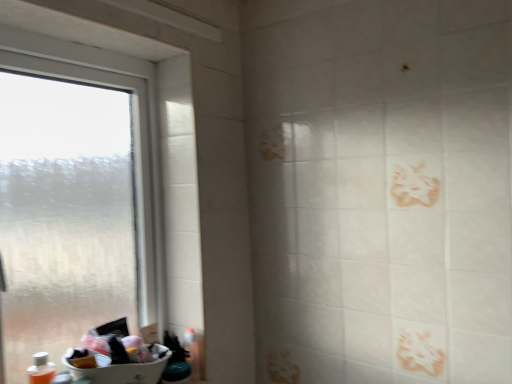
Question: From a real-world perspective, is translucent plastic bottle at lower left located higher than transparent frosted glass window at left?

Choices:
 (A) no
 (B) yes

Answer: (A)

Question: From a real-world perspective, is translucent plastic bottle at lower left under transparent frosted glass window at left?

Choices:
 (A) no
 (B) yes

Answer: (B)

Question: Is translucent plastic bottle at lower left positioned with its back to transparent frosted glass window at left?

Choices:
 (A) yes
 (B) no

Answer: (A)

Question: Can you confirm if translucent plastic bottle at lower left is smaller than transparent frosted glass window at left?

Choices:
 (A) no
 (B) yes

Answer: (B)

Question: Considering the relative sizes of translucent plastic bottle at lower left and transparent frosted glass window at left in the image provided, is translucent plastic bottle at lower left bigger than transparent frosted glass window at left?

Choices:
 (A) no
 (B) yes

Answer: (A)

Question: Are translucent plastic bottle at lower left and transparent frosted glass window at left making contact?

Choices:
 (A) no
 (B) yes

Answer: (A)

Question: Is white plastic sink at lower left further to camera compared to translucent plastic bottle at lower left?

Choices:
 (A) yes
 (B) no

Answer: (B)

Question: Does white plastic sink at lower left come in front of translucent plastic bottle at lower left?

Choices:
 (A) yes
 (B) no

Answer: (A)

Question: Is white plastic sink at lower left outside translucent plastic bottle at lower left?

Choices:
 (A) no
 (B) yes

Answer: (B)

Question: Is white plastic sink at lower left touching translucent plastic bottle at lower left?

Choices:
 (A) yes
 (B) no

Answer: (B)

Question: From the image's perspective, is white plastic sink at lower left under translucent plastic bottle at lower left?

Choices:
 (A) no
 (B) yes

Answer: (A)

Question: Is white plastic sink at lower left thinner than translucent plastic bottle at lower left?

Choices:
 (A) yes
 (B) no

Answer: (B)

Question: Can you confirm if white plastic sink at lower left is taller than transparent frosted glass window at left?

Choices:
 (A) no
 (B) yes

Answer: (A)